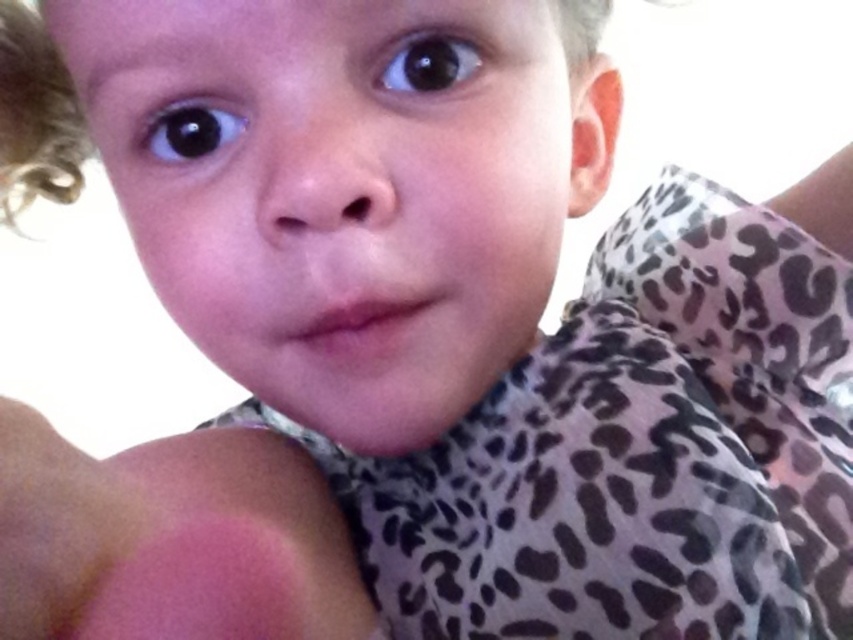
From the picture: You are a photographer trying to capture a closeup of the black glossy eye at upper left. The camera is currently positioned 11.21 inches away from the eye. If you want to ensure the eye fills the frame more, should you move the camera closer or farther away?

Since the camera is currently 11.21 inches away from the black glossy eye at upper left, moving it closer would make the eye appear larger in the frame, while moving it farther away would make it smaller. To have the eye fill the frame more, you should move the camera closer to the black glossy eye at upper left.

Based on the photo, you are a photographer adjusting the lighting for a closeup shot of a child. You notice a bright spot at point (35, 116) in the frame. Based on the scene description, what object is this bright spot most likely reflecting from?

The bright spot at point (35, 116) corresponds to the blonde curly hair at upper left, which has a light color and curly texture that can create such reflections.